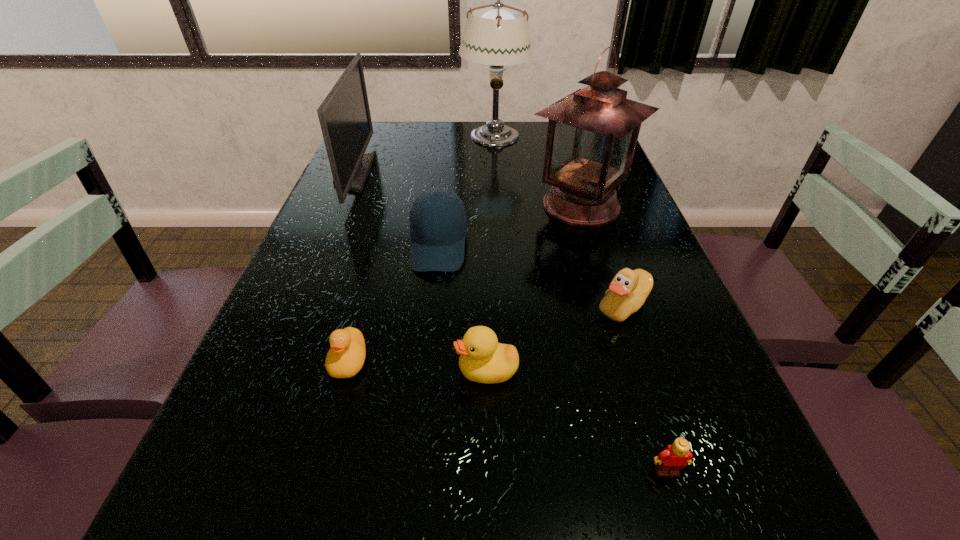
This screenshot has width=960, height=540. Find the location of `lampshade`. lampshade is located at coordinates point(495,36).

Identify the location of oil lamp. This screenshot has width=960, height=540. (592, 134).

The image size is (960, 540). Identify the location of monitor. (344, 115).

This screenshot has width=960, height=540. Find the location of `the sixth shortest object`. the sixth shortest object is located at coordinates [344, 115].

Locate an element on the screen. baseball cap is located at coordinates (438, 226).

At what (x,y) coordinates should I click in order to perform the action: click on the rightmost duck. Please return your answer as a coordinate pair (x, y). The width and height of the screenshot is (960, 540). Looking at the image, I should click on (629, 289).

At what (x,y) coordinates should I click in order to perform the action: click on the fifth farthest object. Please return your answer as a coordinate pair (x, y). The width and height of the screenshot is (960, 540). Looking at the image, I should click on (629, 289).

Locate an element on the screen. Image resolution: width=960 pixels, height=540 pixels. the second duck from left to right is located at coordinates (482, 359).

At what (x,y) coordinates should I click in order to perform the action: click on the shortest duck. Please return your answer as a coordinate pair (x, y). The width and height of the screenshot is (960, 540). Looking at the image, I should click on (346, 357).

This screenshot has width=960, height=540. In order to click on the seventh object from right to left in this screenshot , I will do `click(346, 357)`.